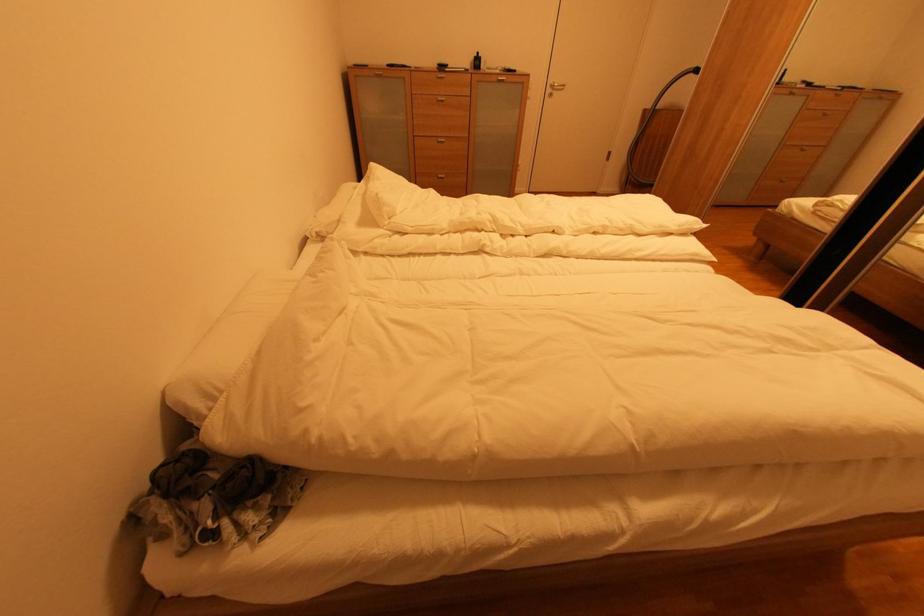
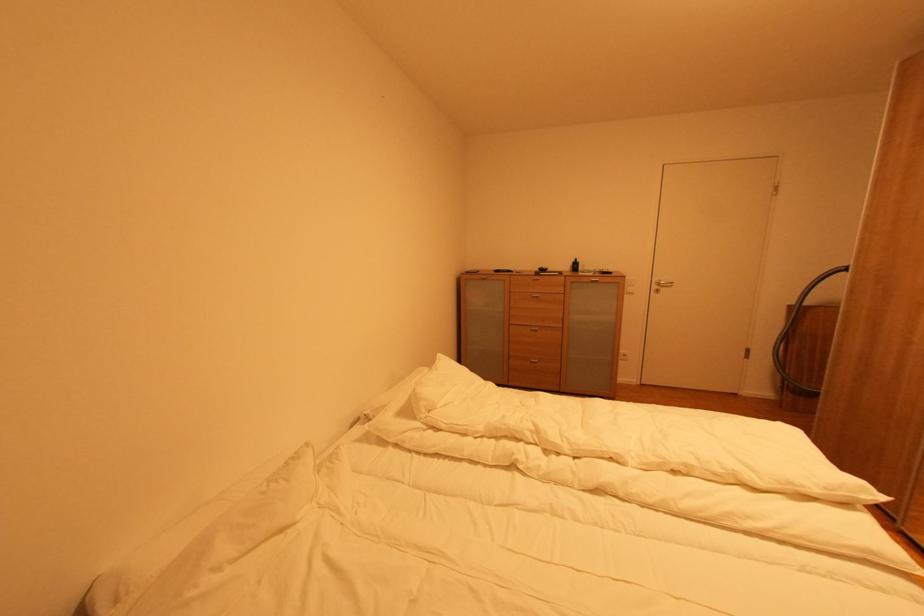
The point at (481, 58) is marked in the first image. Where is the corresponding point in the second image?

(578, 264)